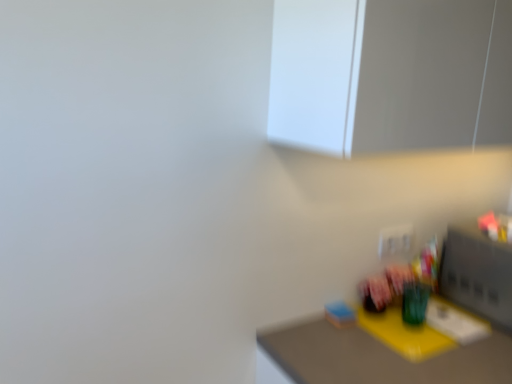
Question: Considering the relative sizes of white glossy medicine cabinet at upper center and yellow matte table at lower right in the image provided, is white glossy medicine cabinet at upper center shorter than yellow matte table at lower right?

Choices:
 (A) no
 (B) yes

Answer: (B)

Question: Is white glossy medicine cabinet at upper center closer to camera compared to yellow matte table at lower right?

Choices:
 (A) yes
 (B) no

Answer: (A)

Question: Does white glossy medicine cabinet at upper center have a greater height compared to yellow matte table at lower right?

Choices:
 (A) no
 (B) yes

Answer: (A)

Question: From a real-world perspective, is white glossy medicine cabinet at upper center located higher than yellow matte table at lower right?

Choices:
 (A) yes
 (B) no

Answer: (A)

Question: From the image's perspective, is white glossy medicine cabinet at upper center under yellow matte table at lower right?

Choices:
 (A) yes
 (B) no

Answer: (B)

Question: Are white glossy medicine cabinet at upper center and yellow matte table at lower right beside each other?

Choices:
 (A) no
 (B) yes

Answer: (A)

Question: Is yellow matte table at lower right completely or partially outside of white glossy medicine cabinet at upper center?

Choices:
 (A) no
 (B) yes

Answer: (B)

Question: From a real-world perspective, is yellow matte table at lower right positioned under white glossy medicine cabinet at upper center based on gravity?

Choices:
 (A) no
 (B) yes

Answer: (B)

Question: From a real-world perspective, does yellow matte table at lower right stand above white glossy medicine cabinet at upper center?

Choices:
 (A) no
 (B) yes

Answer: (A)

Question: Is yellow matte table at lower right oriented away from white glossy medicine cabinet at upper center?

Choices:
 (A) yes
 (B) no

Answer: (B)

Question: Is yellow matte table at lower right not close to white glossy medicine cabinet at upper center?

Choices:
 (A) no
 (B) yes

Answer: (A)

Question: Does yellow matte table at lower right come behind white glossy medicine cabinet at upper center?

Choices:
 (A) yes
 (B) no

Answer: (A)

Question: From their relative heights in the image, would you say yellow matte table at lower right is taller or shorter than white glossy medicine cabinet at upper center?

Choices:
 (A) short
 (B) tall

Answer: (B)